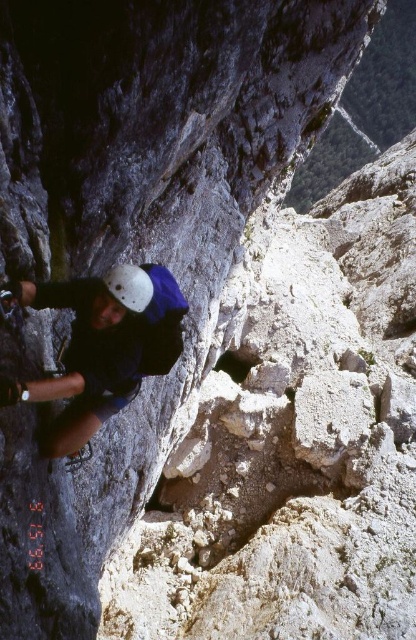
Based on the photo, can you confirm if matte white helmet at left is positioned above white matte helmet at upper left?

No, matte white helmet at left is not above white matte helmet at upper left.

Can you confirm if matte white helmet at left is thinner than white matte helmet at upper left?

No, matte white helmet at left is not thinner than white matte helmet at upper left.

Which is behind, point (99, 424) or point (133, 272)?

The point (99, 424) is more distant.

Locate an element on the screen. matte white helmet at left is located at coordinates (101, 346).